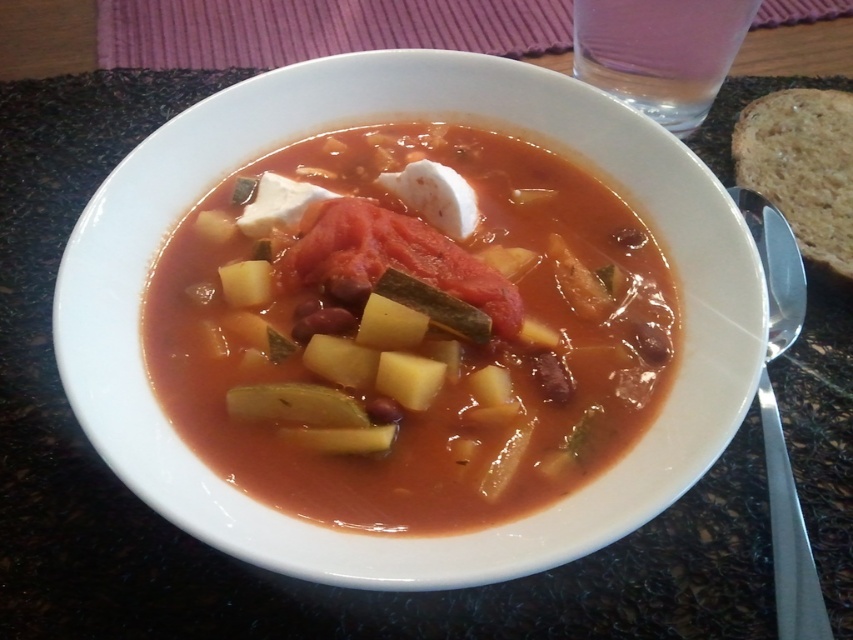
Question: Can you confirm if tomato-yet-soft soup at center is bigger than brown crusty bread at right?

Choices:
 (A) no
 (B) yes

Answer: (B)

Question: Which object is the farthest from the tomato-yet-soft soup at center?

Choices:
 (A) satin silver spoon at right
 (B) brown crusty bread at right

Answer: (B)

Question: Which object is positioned closest to the tomato-yet-soft soup at center?

Choices:
 (A) brown crusty bread at right
 (B) satin silver spoon at right

Answer: (B)

Question: Does brown crusty bread at right appear under satin silver spoon at right?

Choices:
 (A) yes
 (B) no

Answer: (B)

Question: Does tomato-yet-soft soup at center lie behind satin silver spoon at right?

Choices:
 (A) yes
 (B) no

Answer: (B)

Question: Which point is closer to the camera?

Choices:
 (A) brown crusty bread at right
 (B) tomato-yet-soft soup at center

Answer: (B)